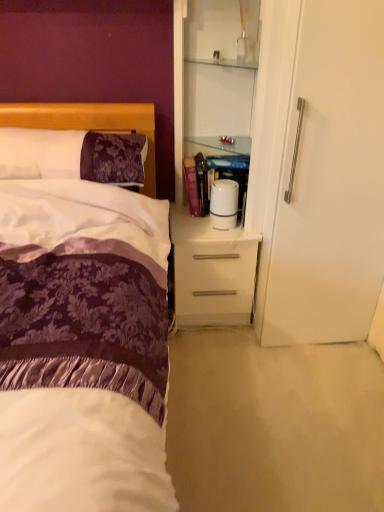
Question: Is purple damask pillow at left taller than white glossy nightstand at center?

Choices:
 (A) yes
 (B) no

Answer: (B)

Question: Is purple damask pillow at left behind white glossy nightstand at center?

Choices:
 (A) no
 (B) yes

Answer: (A)

Question: Is purple damask pillow at left surrounding white glossy nightstand at center?

Choices:
 (A) no
 (B) yes

Answer: (A)

Question: Can you confirm if purple damask pillow at left is positioned to the left of white glossy nightstand at center?

Choices:
 (A) no
 (B) yes

Answer: (B)

Question: From the image's perspective, does purple damask pillow at left appear lower than white glossy nightstand at center?

Choices:
 (A) no
 (B) yes

Answer: (A)

Question: Based on their sizes in the image, would you say purple damask pillow at left is bigger or smaller than white glossy nightstand at center?

Choices:
 (A) big
 (B) small

Answer: (B)

Question: From a real-world perspective, relative to white glossy nightstand at center, is purple damask pillow at left vertically above or below?

Choices:
 (A) above
 (B) below

Answer: (A)

Question: Considering the relative positions of purple damask pillow at left and white glossy nightstand at center in the image provided, is purple damask pillow at left to the left or to the right of white glossy nightstand at center?

Choices:
 (A) right
 (B) left

Answer: (B)

Question: Is purple damask pillow at left taller or shorter than white glossy nightstand at center?

Choices:
 (A) short
 (B) tall

Answer: (A)

Question: Based on their sizes in the image, would you say white glossy nightstand at center is bigger or smaller than white glossy cabinet at upper right?

Choices:
 (A) big
 (B) small

Answer: (B)

Question: From the image's perspective, is white glossy nightstand at center located above or below white glossy cabinet at upper right?

Choices:
 (A) above
 (B) below

Answer: (B)

Question: Is white glossy nightstand at center spatially inside white glossy cabinet at upper right, or outside of it?

Choices:
 (A) outside
 (B) inside

Answer: (A)

Question: From a real-world perspective, is white glossy nightstand at center above or below white glossy cabinet at upper right?

Choices:
 (A) below
 (B) above

Answer: (A)

Question: Considering the positions of point (178, 301) and point (3, 172), is point (178, 301) closer or farther from the camera than point (3, 172)?

Choices:
 (A) closer
 (B) farther

Answer: (B)

Question: Considering the positions of white glossy nightstand at center and purple damask pillow at left in the image, is white glossy nightstand at center wider or thinner than purple damask pillow at left?

Choices:
 (A) wide
 (B) thin

Answer: (A)